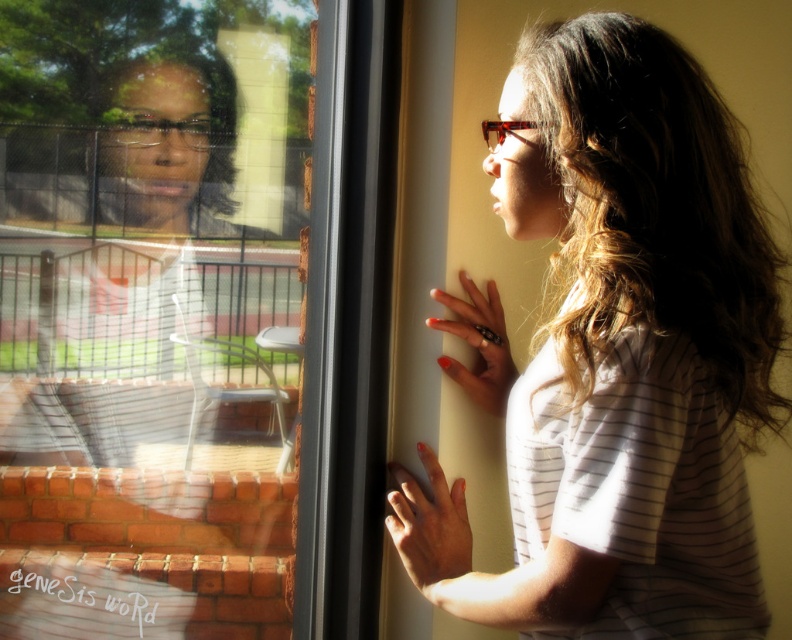
What do you see at coordinates (189, 324) in the screenshot?
I see `transparent glass screen door at left` at bounding box center [189, 324].

Which is below, transparent glass screen door at left or matte white shirt at center?

transparent glass screen door at left is lower down.

Which is in front, point (314, 412) or point (532, 221)?

Point (532, 221) is more forward.

Where is `transparent glass screen door at left`? transparent glass screen door at left is located at coordinates (189, 324).